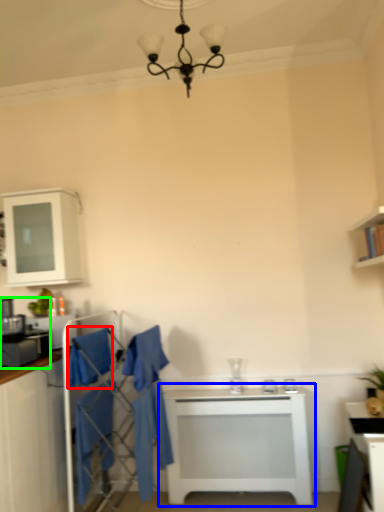
Question: Which is nearer to the robe (highlighted by a red box)? table (highlighted by a blue box) or appliance (highlighted by a green box).

Choices:
 (A) table
 (B) appliance

Answer: (B)